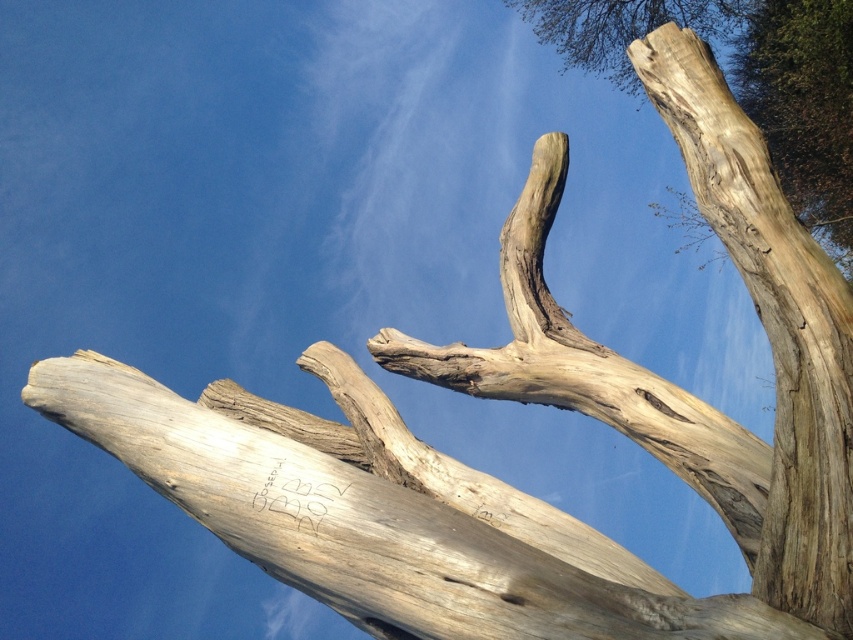
You are an artist sketching the tree trunk. You notice two light brown wood at upper right and natural wood tree trunk at upper right. Which one is shorter in height?

The light brown wood at upper right has a lesser height compared to natural wood tree trunk at upper right, so the light brown wood at upper right is shorter.

You are a botanist examining the image of the tree trunk. You notice the light brown wood at upper right. Based on its coordinates, can you determine its position relative to the center of the image?

The light brown wood at upper right is located at point (x=773, y=328), which means it is positioned slightly to the right and very close to the top of the image, making it near the upper right corner relative to the center.

You are standing in front of the tree trunk and notice a specific point marked at coordinates point (773, 328). What color is the wood at that location?

The wood at point (773, 328) is light brown.